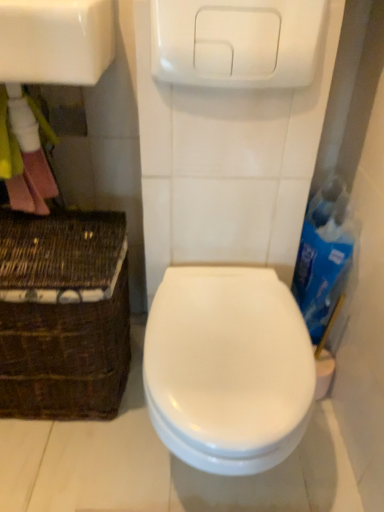
The height and width of the screenshot is (512, 384). Identify the location of free point above white glossy toilet at center (from a real-world perspective). (233, 295).